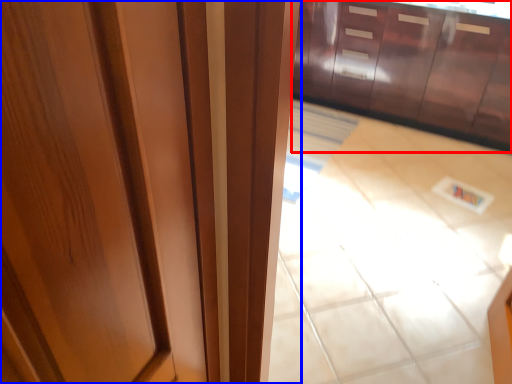
Question: Which point is further to the camera, cabinetry (highlighted by a red box) or door (highlighted by a blue box)?

Choices:
 (A) cabinetry
 (B) door

Answer: (A)